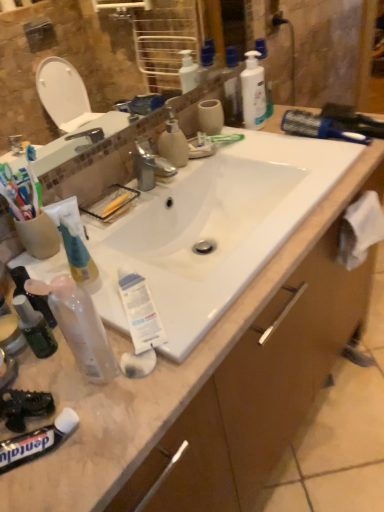
This screenshot has height=512, width=384. I want to click on free location in front of translucent plastic mouthwash at lower left, so click(x=72, y=418).